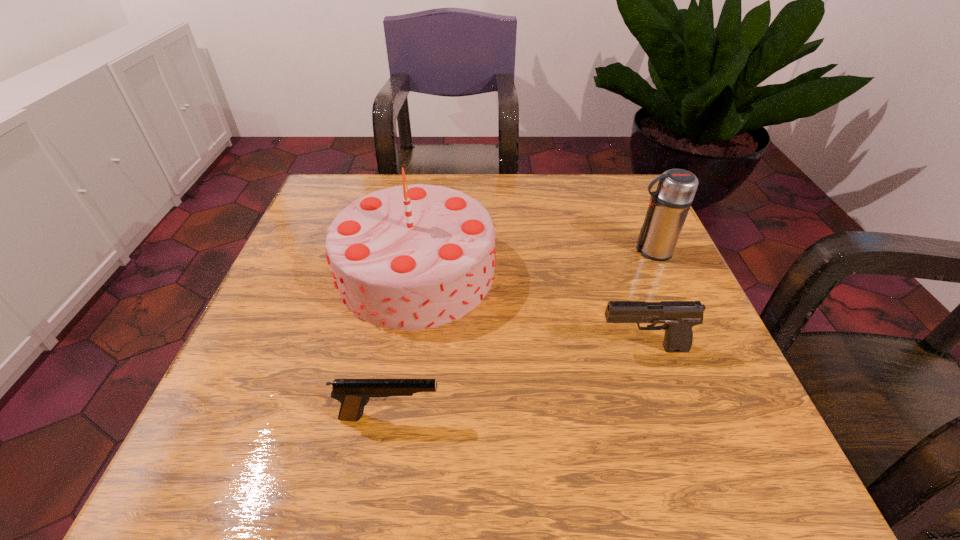
Where is `vacant space at the near edge`? This screenshot has height=540, width=960. vacant space at the near edge is located at coordinates (489, 448).

Locate an element on the screen. free space at the left edge of the desktop is located at coordinates (305, 251).

Image resolution: width=960 pixels, height=540 pixels. In the image, there is a desktop. Identify the location of free space at the far left corner. (350, 188).

Where is `vacant space at the near left corner of the desktop`? This screenshot has width=960, height=540. vacant space at the near left corner of the desktop is located at coordinates (261, 434).

Where is `free space at the far right corner`? free space at the far right corner is located at coordinates point(630,187).

Identify the location of vacant space at the near right corner. The width and height of the screenshot is (960, 540). (696, 440).

You are a GUI agent. You are given a task and a screenshot of the screen. Output one action in this format:
    pyautogui.click(x=<x>, y=<y>)
    Task: Click on the empty space that is in between the thermos bottle and the nearer pistol
    
    Given the screenshot: What is the action you would take?
    pyautogui.click(x=520, y=333)

In order to click on vacant space that's between the third farthest object and the tallest object in this screenshot , I will do `click(529, 310)`.

Find the location of a particular element. The image size is (960, 540). free point between the second tallest object and the shortest object is located at coordinates (520, 333).

Identify the location of free space between the nearer pistol and the tallest object. 403,343.